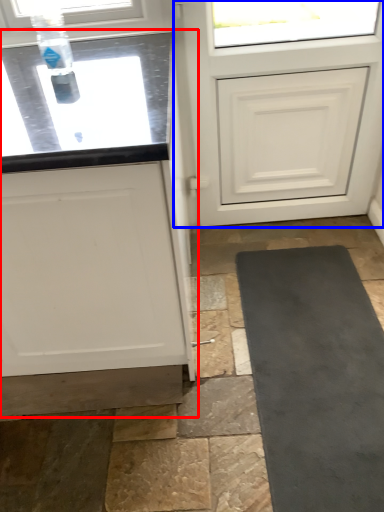
Question: Which object appears closest to the camera in this image, cabinetry (highlighted by a red box) or door (highlighted by a blue box)?

Choices:
 (A) cabinetry
 (B) door

Answer: (A)